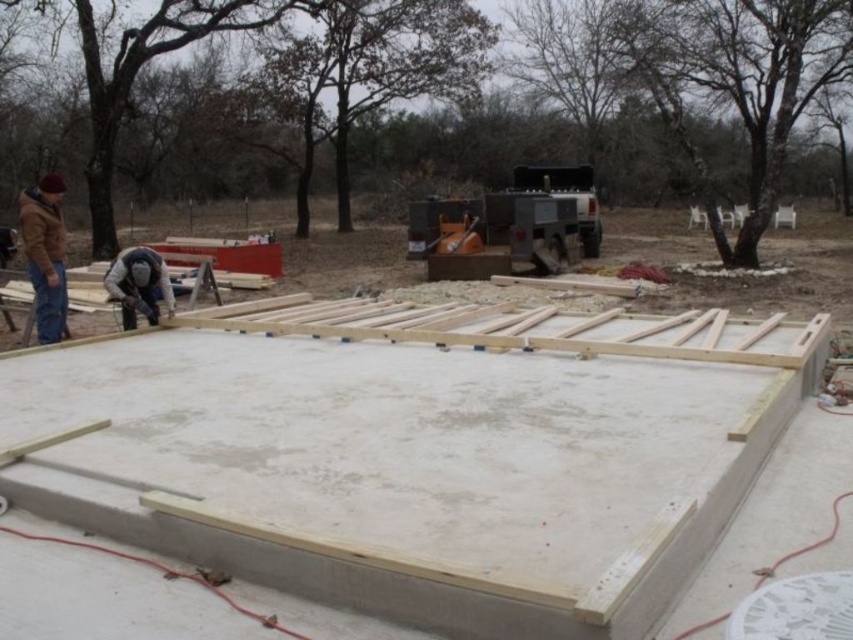
You are a construction worker standing near the edge of the concrete slab. You need to move a tool from the brown leather jacket at left to the light brown wood at center. In which direction should you move the tool?

The light brown wood at center is to the right of the brown leather jacket at left, so you should move the tool to the right.

You are a construction inspector evaluating the site. You notice the light brown wood at center and the brown leather jacket at left. Which object is taller?

The brown leather jacket at left is taller than the light brown wood at center.

You are a construction worker standing at the edge of the concrete slab. You need to place a new wooden beam exactly at the center of the construction site. According to the coordinates provided, where should you position the light brown wood at center?

The light brown wood at center should be positioned at the coordinates point (427, 470) as specified in the description.